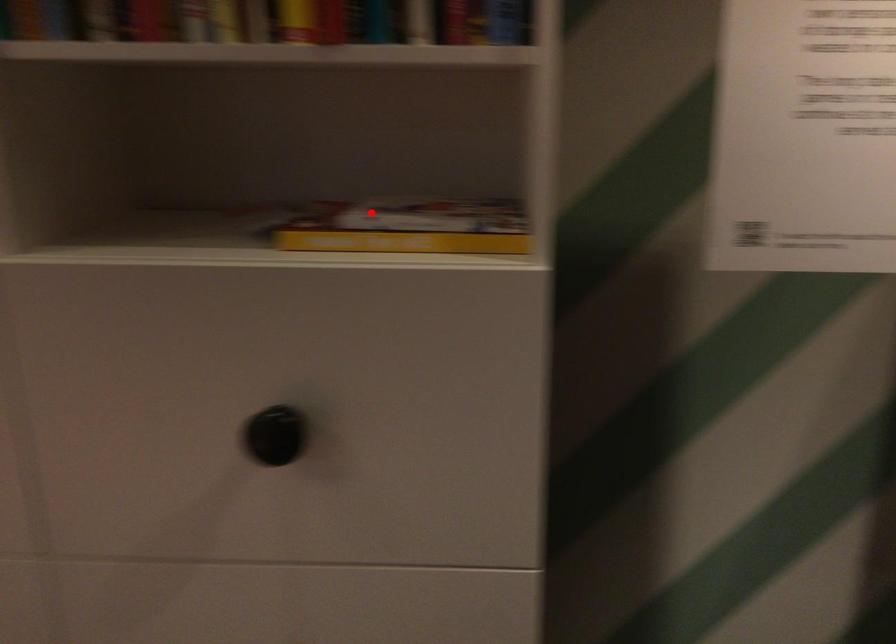
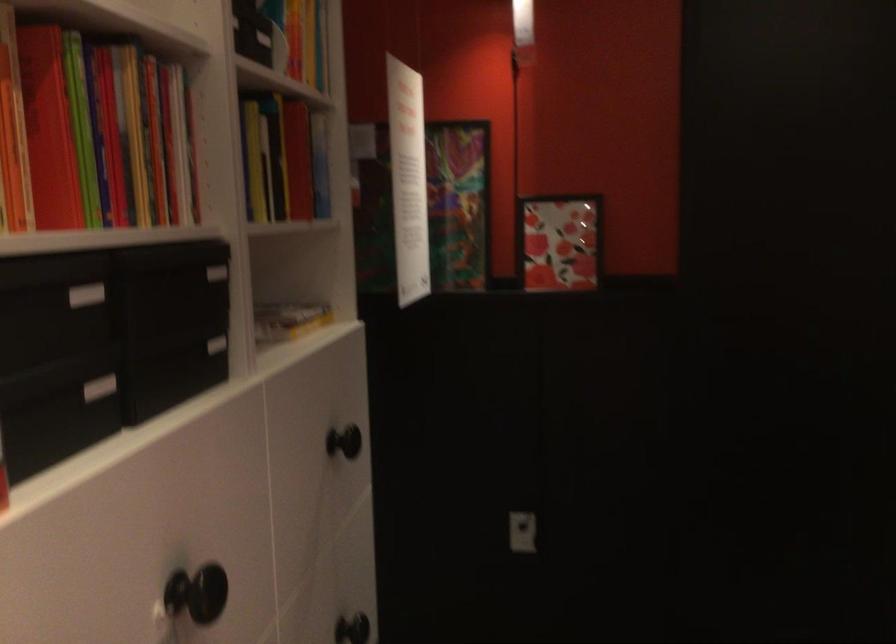
Question: I am providing you with two images of the same scene from different viewpoints. A red point is shown in image1. For the corresponding object point in image2, is it positioned nearer or farther from the camera?

Choices:
 (A) Nearer
 (B) Farther

Answer: (B)